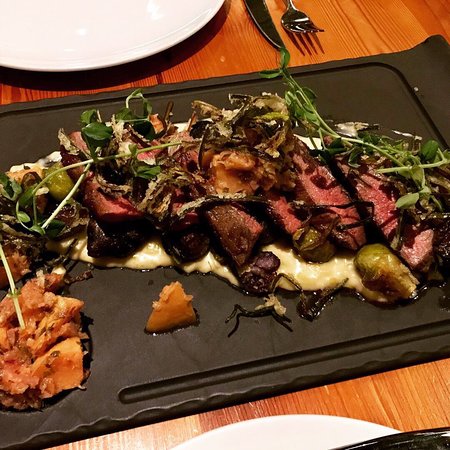
Where is `wooden table below tray`? The image size is (450, 450). wooden table below tray is located at coordinates (414, 406).